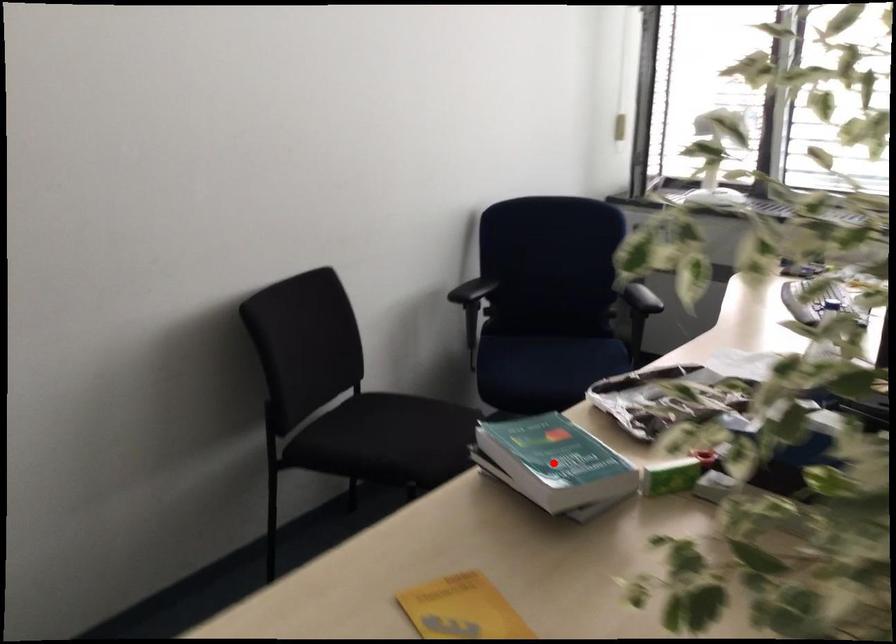
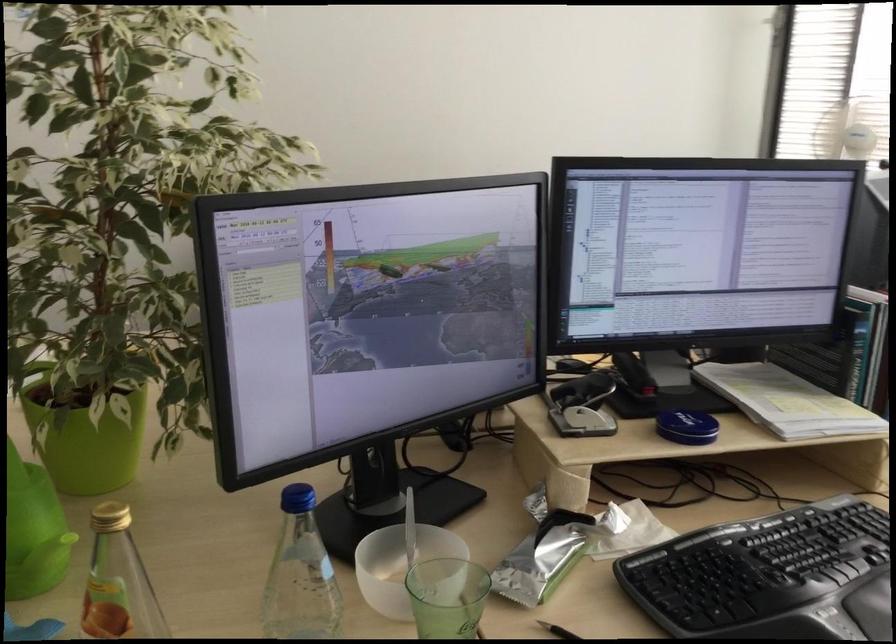
Question: I am providing you with two images of the same scene from different viewpoints. A red point is marked on the first image. At the location where the point appears in image 1, is it still visible in image 2?

Choices:
 (A) Yes
 (B) No

Answer: (B)